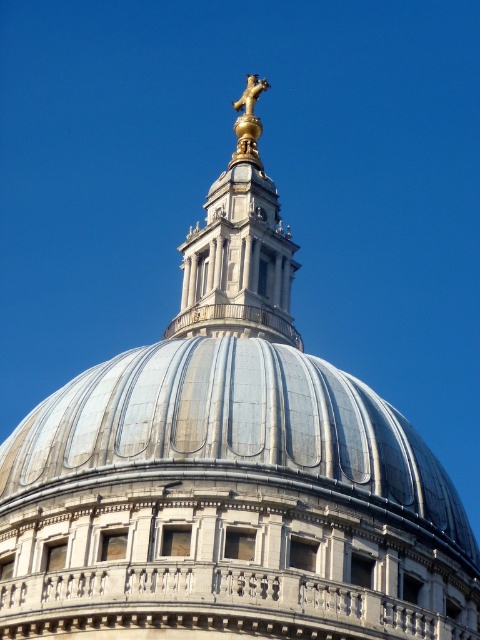
Question: Is silver metallic dome at center thinner than gold polished statue at top?

Choices:
 (A) no
 (B) yes

Answer: (A)

Question: Is gold polished statue at upper center above gold polished statue at top?

Choices:
 (A) yes
 (B) no

Answer: (B)

Question: Estimate the real-world distances between objects in this image. Which object is closer to the silver metallic dome at center?

Choices:
 (A) gold polished statue at top
 (B) gold polished statue at upper center

Answer: (B)

Question: Which point is closer to the camera?

Choices:
 (A) gold polished statue at top
 (B) silver metallic dome at center
 (C) gold polished statue at upper center

Answer: (B)

Question: Which object is positioned farthest from the gold polished statue at top?

Choices:
 (A) gold polished statue at upper center
 (B) silver metallic dome at center

Answer: (B)

Question: Does silver metallic dome at center have a larger size compared to gold polished statue at upper center?

Choices:
 (A) no
 (B) yes

Answer: (A)